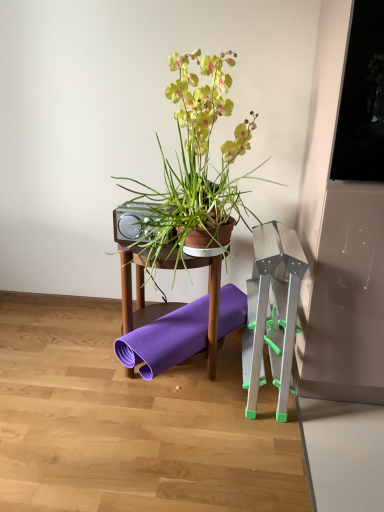
Question: From the image's perspective, is wooden table at center on silver metallic step stool at right?

Choices:
 (A) no
 (B) yes

Answer: (A)

Question: From the image's perspective, is wooden table at center below silver metallic step stool at right?

Choices:
 (A) no
 (B) yes

Answer: (B)

Question: Considering the relative positions of wooden table at center and silver metallic step stool at right in the image provided, is wooden table at center behind silver metallic step stool at right?

Choices:
 (A) no
 (B) yes

Answer: (B)

Question: Are wooden table at center and silver metallic step stool at right far apart?

Choices:
 (A) no
 (B) yes

Answer: (A)

Question: From a real-world perspective, does wooden table at center stand above silver metallic step stool at right?

Choices:
 (A) no
 (B) yes

Answer: (A)

Question: Is point (226, 89) closer or farther from the camera than point (251, 291)?

Choices:
 (A) closer
 (B) farther

Answer: (B)

Question: In terms of height, does matte brown pot at center look taller or shorter compared to silver metallic step stool at right?

Choices:
 (A) tall
 (B) short

Answer: (B)

Question: In the image, is matte brown pot at center on the left side or the right side of silver metallic step stool at right?

Choices:
 (A) left
 (B) right

Answer: (A)

Question: Considering the positions of matte brown pot at center and silver metallic step stool at right in the image, is matte brown pot at center wider or thinner than silver metallic step stool at right?

Choices:
 (A) thin
 (B) wide

Answer: (A)

Question: Looking at their shapes, would you say metallic silver speaker at center is wider or thinner than transparent glass window screen at upper right?

Choices:
 (A) wide
 (B) thin

Answer: (B)

Question: Based on their positions, is metallic silver speaker at center located to the left or right of transparent glass window screen at upper right?

Choices:
 (A) right
 (B) left

Answer: (B)

Question: Does point (119, 225) appear closer or farther from the camera than point (372, 136)?

Choices:
 (A) farther
 (B) closer

Answer: (A)

Question: Considering the positions of metallic silver speaker at center and transparent glass window screen at upper right in the image, is metallic silver speaker at center bigger or smaller than transparent glass window screen at upper right?

Choices:
 (A) big
 (B) small

Answer: (B)

Question: Is transparent glass window screen at upper right wider or thinner than metallic silver speaker at center?

Choices:
 (A) thin
 (B) wide

Answer: (B)

Question: Is transparent glass window screen at upper right spatially inside metallic silver speaker at center, or outside of it?

Choices:
 (A) outside
 (B) inside

Answer: (A)